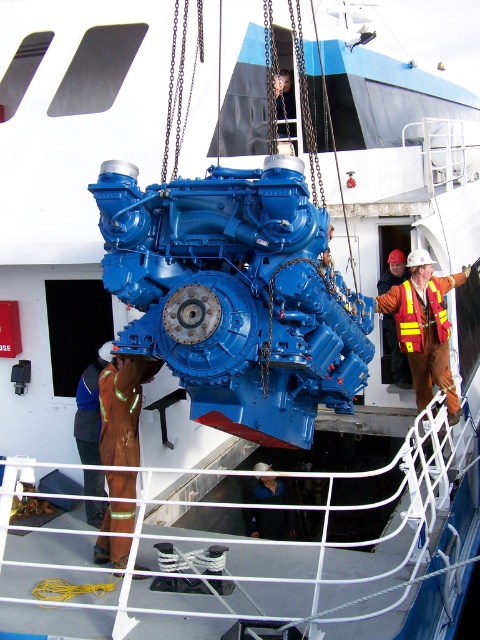
Question: Is brown reflective safety suit at lower left bigger than brown reflective safety vest at lower left?

Choices:
 (A) yes
 (B) no

Answer: (A)

Question: Which object appears closest to the camera in this image?

Choices:
 (A) brown reflective safety vest at lower left
 (B) reflective yellow safety vest at right

Answer: (A)

Question: Which point appears closest to the camera in this image?

Choices:
 (A) (263, 461)
 (B) (133, 358)

Answer: (B)

Question: Can you confirm if reflective yellow safety vest at right is bigger than brown reflective safety vest at lower left?

Choices:
 (A) no
 (B) yes

Answer: (B)

Question: Does reflective yellow safety vest at right appear on the left side of brown reflective safety vest at lower left?

Choices:
 (A) yes
 (B) no

Answer: (B)

Question: Which object appears closest to the camera in this image?

Choices:
 (A) dark blue uniform at center
 (B) yellow reflective safety vest at right
 (C) brown reflective safety vest at lower left
 (D) brown reflective safety suit at lower left

Answer: (D)